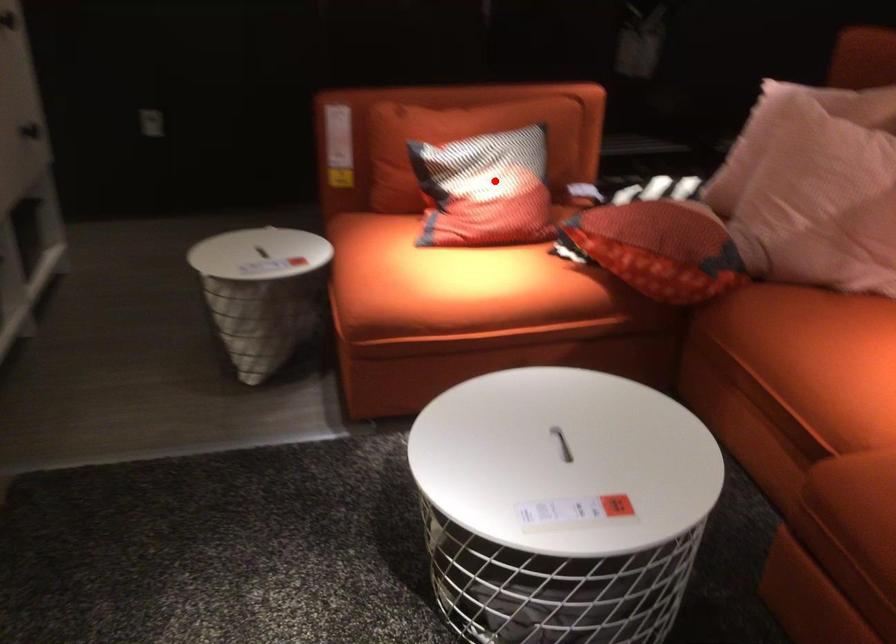
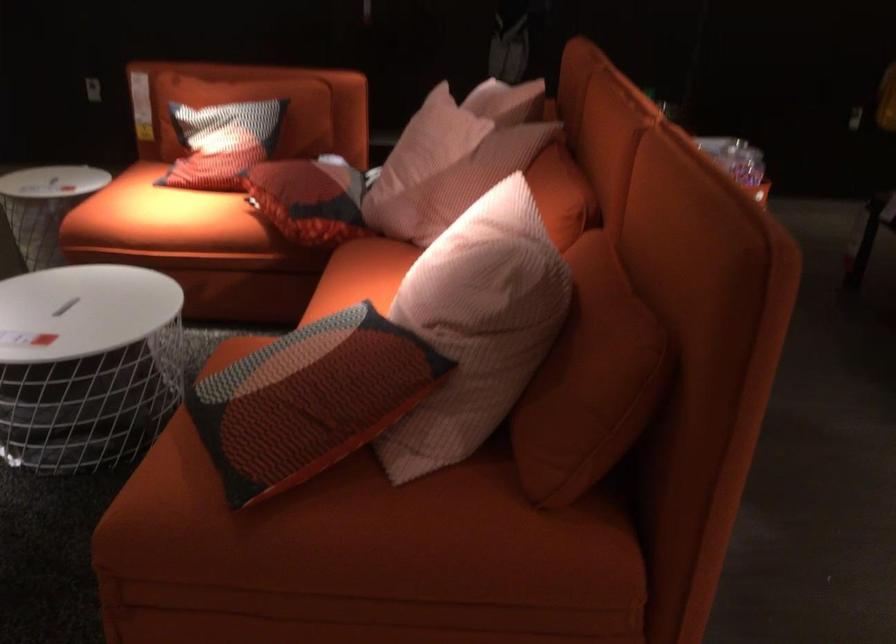
Question: I am providing you with two images of the same scene from different viewpoints. Given a red point in image1, look at the same physical point in image2. Is it:

Choices:
 (A) Closer to the viewpoint
 (B) Farther from the viewpoint

Answer: (B)